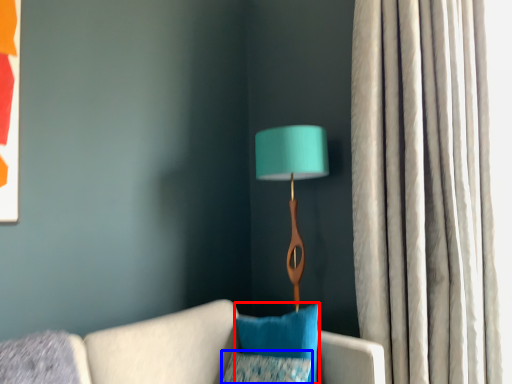
Question: Which of the following is the closest to the observer, pillow (highlighted by a red box) or pillow (highlighted by a blue box)?

Choices:
 (A) pillow
 (B) pillow

Answer: (B)